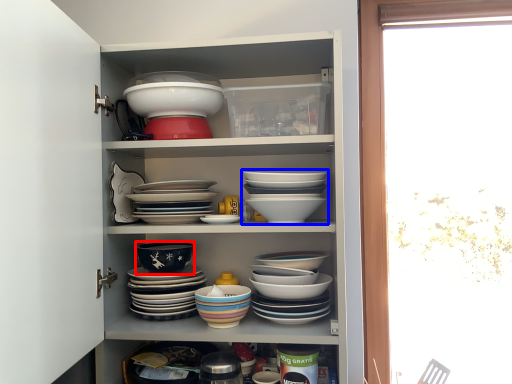
Question: Which object appears closest to the camera in this image, bowl (highlighted by a red box) or bowl (highlighted by a blue box)?

Choices:
 (A) bowl
 (B) bowl

Answer: (B)